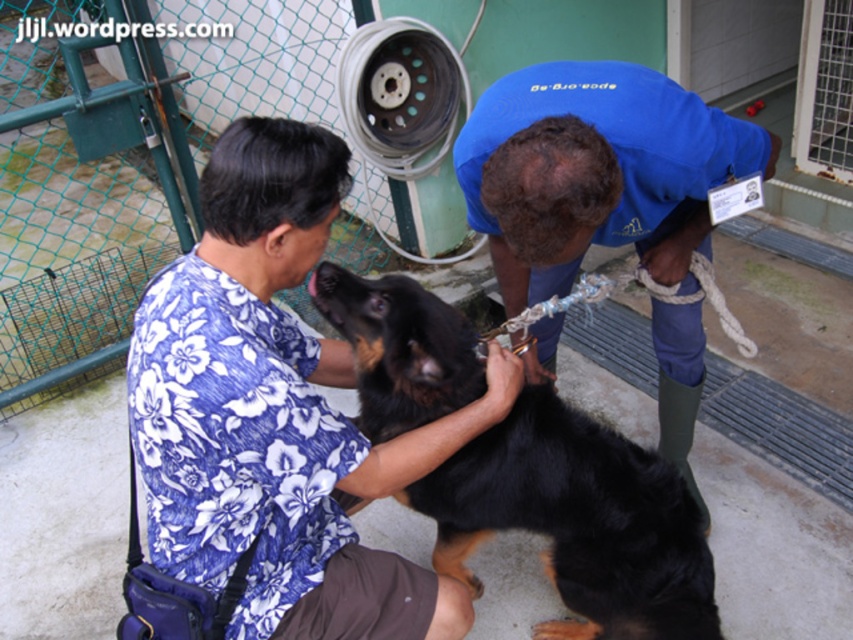
You are a visitor at an animal shelter and see the black fur dog at center and the blue fabric shirt at center. Which object is closer to you?

The black fur dog at center is closer to you because the blue fabric shirt at center is behind it.

You are a visitor at an animal care center and see the black dog with brown markings. The dog is at the center of the image. There is a point marked at coordinates [578,522]. Based on the scene, where is this point located on the dog?

The point at coordinates [578,522] is located on the black fur dog at center.